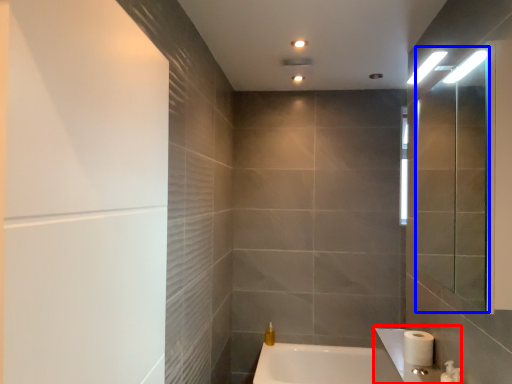
Question: Which of the following is the closest to the observer, sink (highlighted by a red box) or mirror (highlighted by a blue box)?

Choices:
 (A) sink
 (B) mirror

Answer: (B)